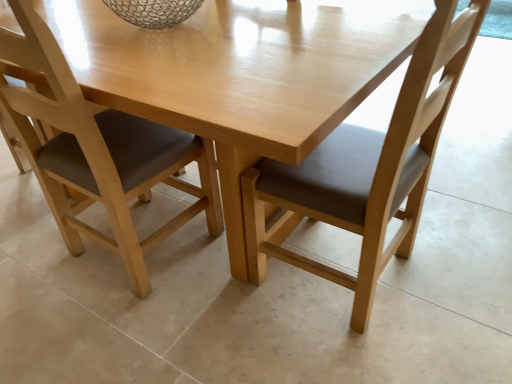
Question: From the image's perspective, is light wood table at center above or below matte wood chair at center, the second chair positioned from the left?

Choices:
 (A) above
 (B) below

Answer: (A)

Question: Is light wood table at center taller or shorter than matte wood chair at center, the 1th chair from the right?

Choices:
 (A) tall
 (B) short

Answer: (B)

Question: Considering the real-world distances, which object is closest to the light wood table at center?

Choices:
 (A) matte wood chair at lower left, positioned as the 2th chair in right-to-left order
 (B) matte wood chair at center, the 1th chair from the right

Answer: (B)

Question: Estimate the real-world distances between objects in this image. Which object is closer to the matte wood chair at center, the second chair positioned from the left?

Choices:
 (A) matte wood chair at lower left, the first chair from the left
 (B) light wood table at center

Answer: (B)